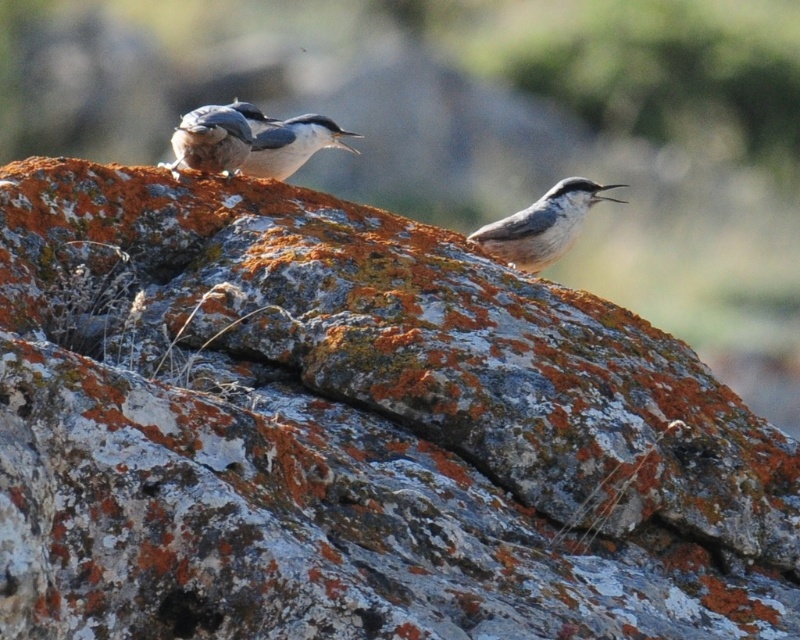
Question: Is the position of matte gray bird at upper left more distant than that of white matte bird at center?

Choices:
 (A) no
 (B) yes

Answer: (A)

Question: Which point appears farthest from the camera in this image?

Choices:
 (A) (308, 140)
 (B) (548, 243)
 (C) (224, 150)

Answer: (A)

Question: Is matte gray bird at upper left behind white matte bird at center?

Choices:
 (A) no
 (B) yes

Answer: (A)

Question: Is matte gray bird at upper left bigger than white matte bird at center?

Choices:
 (A) no
 (B) yes

Answer: (B)

Question: Among these objects, which one is nearest to the camera?

Choices:
 (A) matte gray bird at upper left
 (B) white matte bird at center

Answer: (A)

Question: Based on their relative distances, which object is nearer to the brown speckled bird at center?

Choices:
 (A) white matte bird at center
 (B) matte gray bird at upper left

Answer: (A)